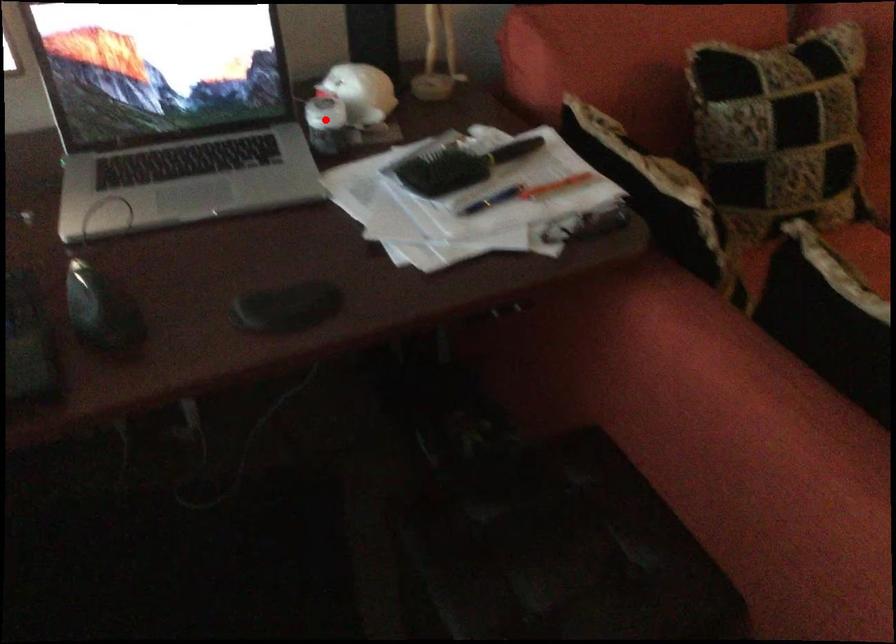
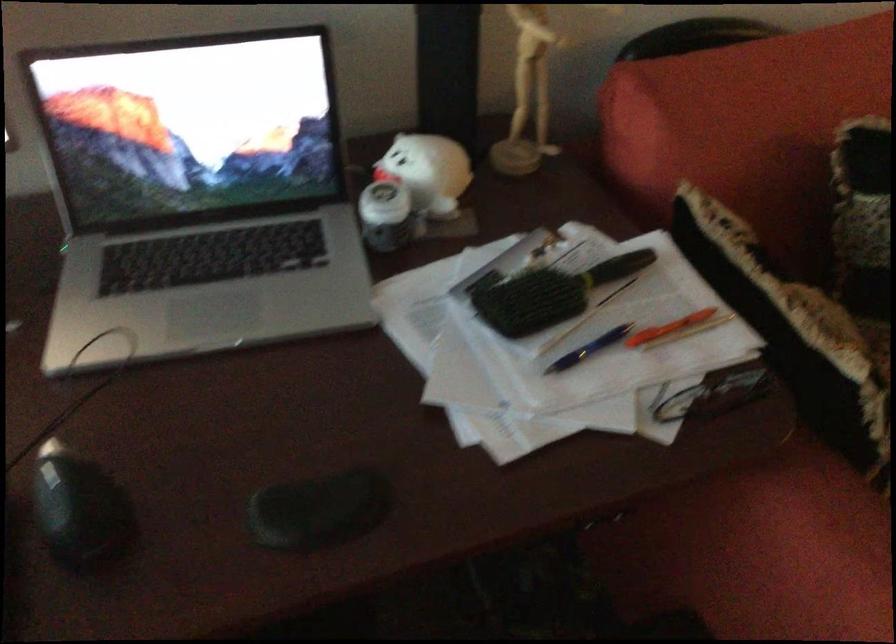
Question: I am providing you with two images of the same scene from different viewpoints. In image1, a red point is highlighted. Considering the same 3D point in image2, which of the following is correct?

Choices:
 (A) It is closer
 (B) It is farther

Answer: (A)